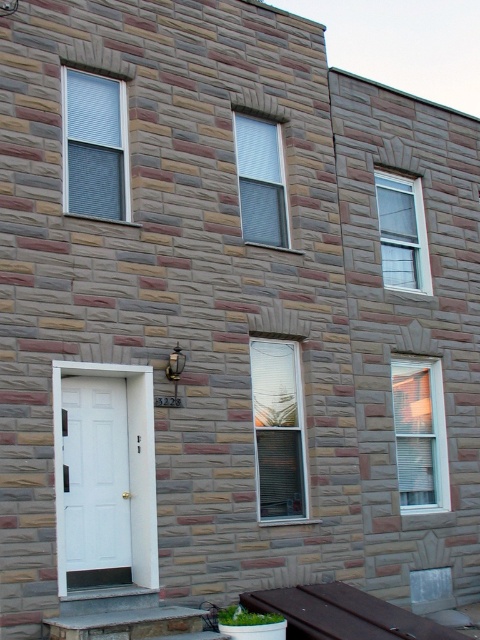
This screenshot has width=480, height=640. Find the location of `white textured window at center`. white textured window at center is located at coordinates (261, 180).

Is white textured window at center to the right of clear glass window at upper center from the viewer's perspective?

Incorrect, white textured window at center is not on the right side of clear glass window at upper center.

Is point (275, 125) more distant than point (385, 186)?

No, it is in front of (385, 186).

The height and width of the screenshot is (640, 480). Identify the location of white textured window at center. (261, 180).

Which is behind, point (265, 404) or point (238, 154)?

Positioned behind is point (238, 154).

Locate an element on the screen. The width and height of the screenshot is (480, 640). clear glass window at center is located at coordinates (277, 428).

Which is more to the left, white matte door at lower left or white textured window at center?

white matte door at lower left is more to the left.

Can you confirm if white matte door at lower left is taller than white textured window at center?

Yes, white matte door at lower left is taller than white textured window at center.

I want to click on white matte door at lower left, so click(x=96, y=481).